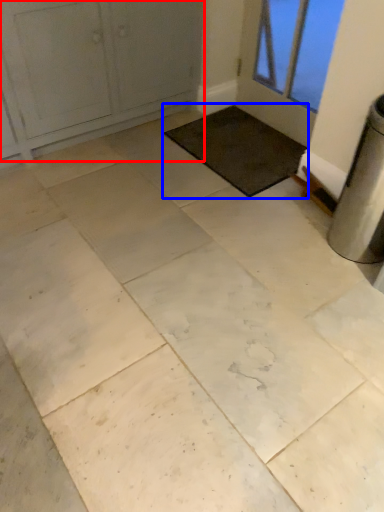
Question: Which object appears farthest to the camera in this image, door (highlighted by a red box) or mat (highlighted by a blue box)?

Choices:
 (A) door
 (B) mat

Answer: (B)